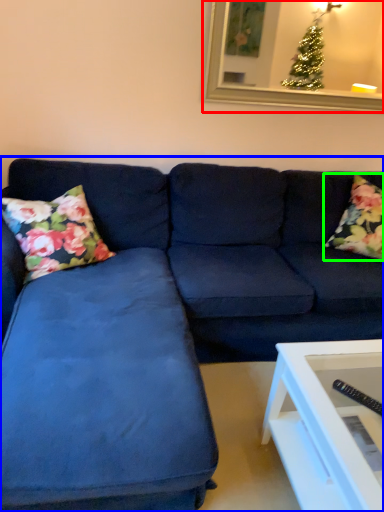
Question: Which object is positioned farthest from picture frame (highlighted by a red box)? Select from studio couch (highlighted by a blue box) and pillow (highlighted by a green box).

Choices:
 (A) studio couch
 (B) pillow

Answer: (A)